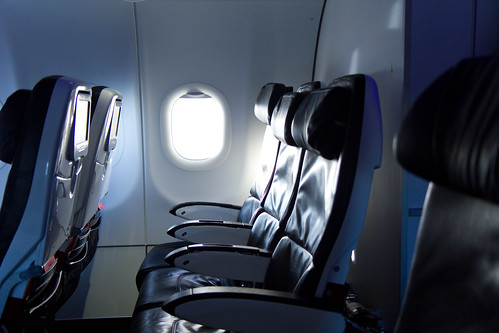
Locate an element on the screen. The height and width of the screenshot is (333, 499). seats is located at coordinates click(69, 153), click(110, 137), click(267, 173), click(287, 187), click(332, 207), click(436, 247).